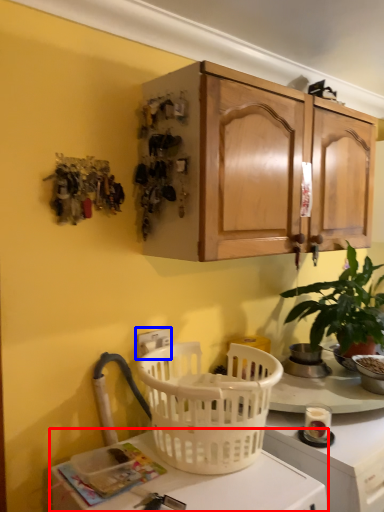
Question: Which point is further to the camera, desk (highlighted by a red box) or electric outlet (highlighted by a blue box)?

Choices:
 (A) desk
 (B) electric outlet

Answer: (B)